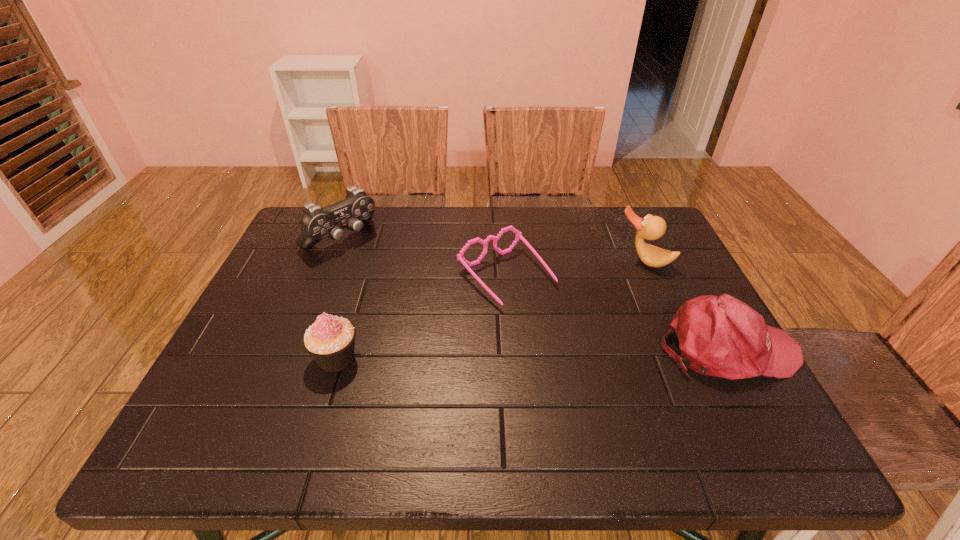
Where is `unoccupied area between the baseball cap and the cupcake`? Image resolution: width=960 pixels, height=540 pixels. unoccupied area between the baseball cap and the cupcake is located at coordinates (532, 353).

Locate an element on the screen. The width and height of the screenshot is (960, 540). vacant space in between the cupcake and the baseball cap is located at coordinates (532, 353).

Find the location of a particular element. the closest object to the third object from right to left is located at coordinates (651, 227).

Find the location of a particular element. The height and width of the screenshot is (540, 960). object that can be found as the third closest to the cupcake is located at coordinates (721, 336).

Identify the location of vacant region that satisfies the following two spatial constraints: 1. on the front side of the baseball cap; 2. at the front of the duck with the brim. Image resolution: width=960 pixels, height=540 pixels. (682, 348).

At what (x,y) coordinates should I click in order to perform the action: click on vacant space that satisfies the following two spatial constraints: 1. on the back side of the baseball cap; 2. at the front of the cupcake with the brim. Please return your answer as a coordinate pair (x, y). The width and height of the screenshot is (960, 540). Looking at the image, I should click on (340, 348).

Where is `vacant space that satisfies the following two spatial constraints: 1. on the back side of the cupcake; 2. on the right side of the duck`? The height and width of the screenshot is (540, 960). vacant space that satisfies the following two spatial constraints: 1. on the back side of the cupcake; 2. on the right side of the duck is located at coordinates (367, 260).